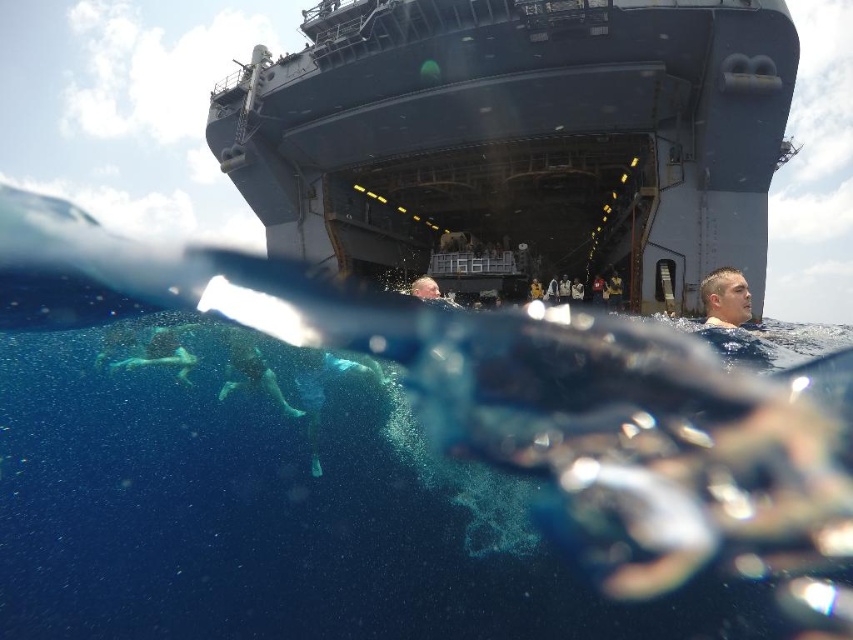
Between transparent blue water at center and green fabric swimmer at lower center, which one is positioned higher?

Positioned higher is green fabric swimmer at lower center.

Which of these two, transparent blue water at center or green fabric swimmer at lower center, stands shorter?

With less height is green fabric swimmer at lower center.

What do you see at coordinates (277, 513) in the screenshot? This screenshot has height=640, width=853. I see `transparent blue water at center` at bounding box center [277, 513].

This screenshot has height=640, width=853. I want to click on transparent blue water at center, so click(277, 513).

Is dark gray metallic ship at upper center below blue fabric swimmer at lower left?

Result: No.

Is dark gray metallic ship at upper center thinner than blue fabric swimmer at lower left?

No, dark gray metallic ship at upper center is not thinner than blue fabric swimmer at lower left.

This screenshot has width=853, height=640. Find the location of `dark gray metallic ship at upper center`. dark gray metallic ship at upper center is located at coordinates (519, 134).

In order to click on dark gray metallic ship at upper center in this screenshot , I will do click(x=519, y=134).

Can you confirm if transparent blue water at center is positioned below blue fabric swimmer at lower left?

Yes, transparent blue water at center is below blue fabric swimmer at lower left.

Is point (157, 378) closer to camera compared to point (173, 356)?

No.

Locate an element on the screen. The width and height of the screenshot is (853, 640). transparent blue water at center is located at coordinates (277, 513).